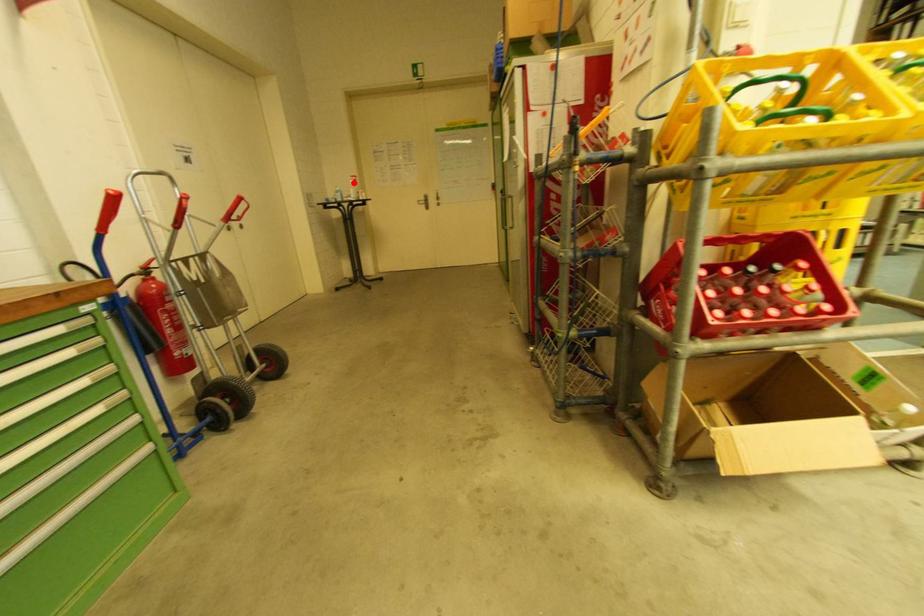
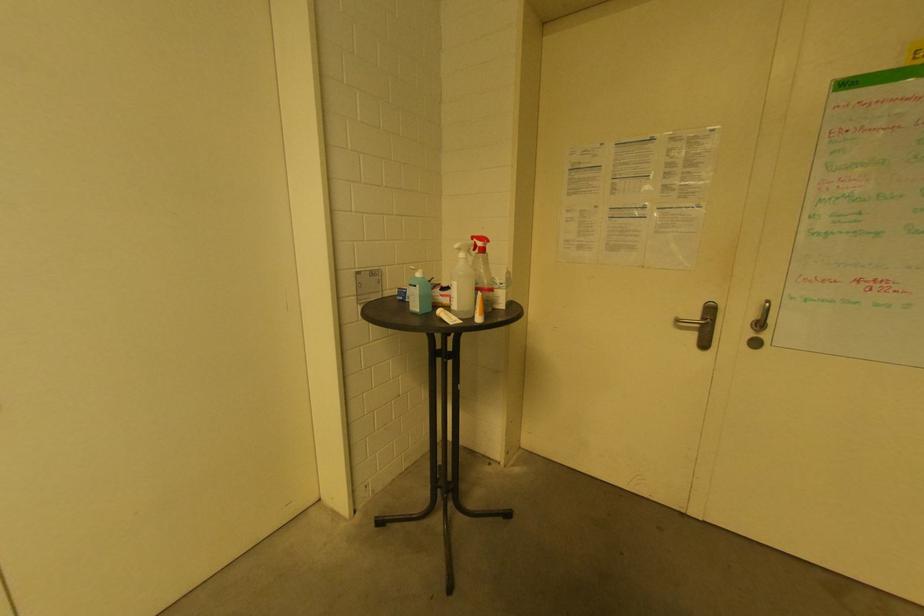
Where in the second image is the point corresponding to the highlighted location from the first image?

(464, 256)